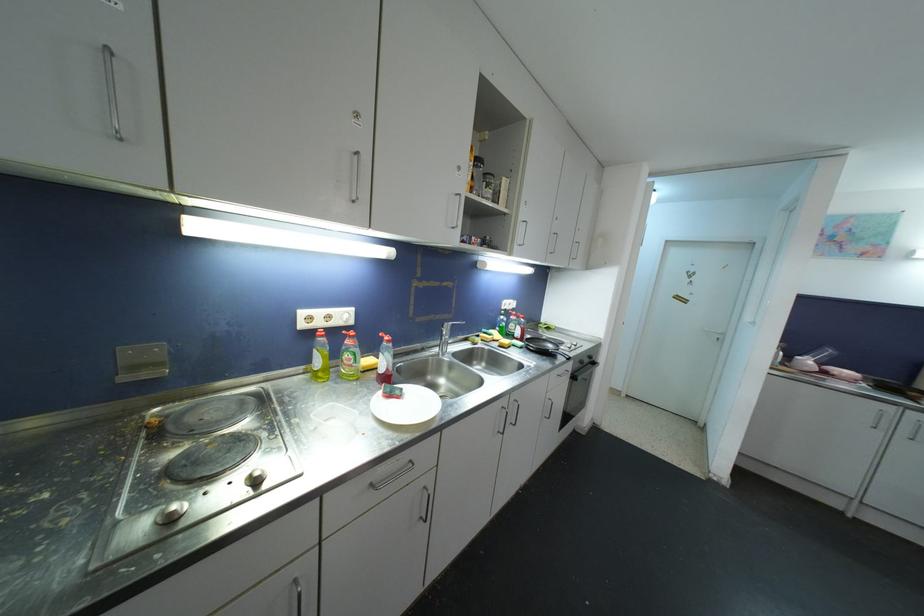
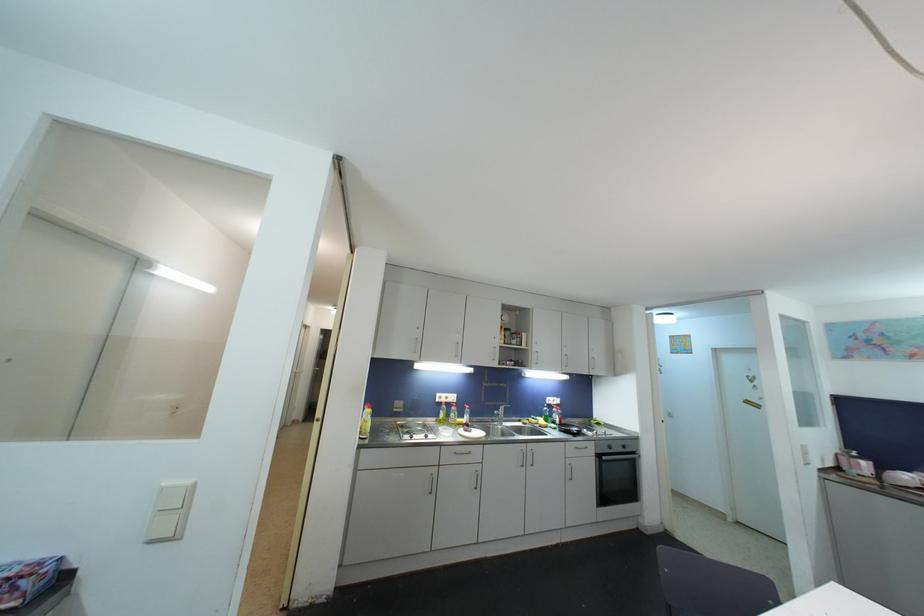
Find the pixel in the second image that matches (305,328) in the first image.

(441, 403)